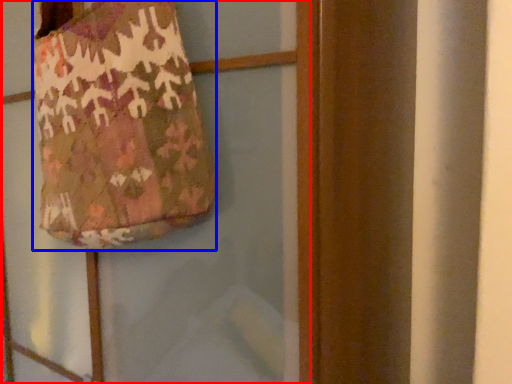
Question: Which object is further to the camera taking this photo, screen door (highlighted by a red box) or handbag (highlighted by a blue box)?

Choices:
 (A) screen door
 (B) handbag

Answer: (B)